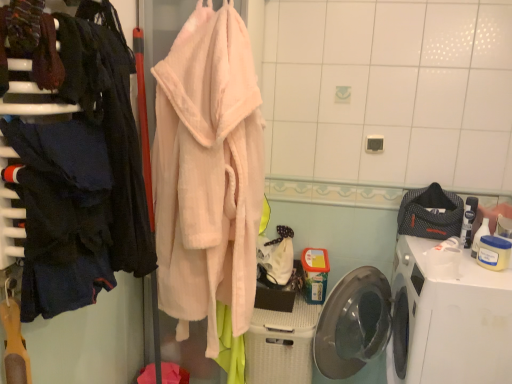
Question: Are white plastic washing machine at lower right and dark blue fabric at left, which is the first closet from front to back, far apart?

Choices:
 (A) yes
 (B) no

Answer: (A)

Question: From the image's perspective, is white plastic washing machine at lower right beneath dark blue fabric at left, the second closet when ordered from back to front?

Choices:
 (A) yes
 (B) no

Answer: (A)

Question: Is white plastic washing machine at lower right oriented away from dark blue fabric at left, which is the first closet from front to back?

Choices:
 (A) no
 (B) yes

Answer: (A)

Question: Considering the relative sizes of white plastic washing machine at lower right and dark blue fabric at left, the second closet when ordered from back to front, in the image provided, is white plastic washing machine at lower right bigger than dark blue fabric at left, the second closet when ordered from back to front,?

Choices:
 (A) no
 (B) yes

Answer: (B)

Question: Is white plastic washing machine at lower right placed right next to dark blue fabric at left, which is the first closet from front to back?

Choices:
 (A) no
 (B) yes

Answer: (A)

Question: Does point (103, 228) appear closer or farther from the camera than point (253, 377)?

Choices:
 (A) closer
 (B) farther

Answer: (A)

Question: Is dark blue fabric at left, marked as the first clothing in a left-to-right arrangement, inside the boundaries of white plastic basket at lower center, or outside?

Choices:
 (A) outside
 (B) inside

Answer: (A)

Question: In terms of width, does dark blue fabric at left, marked as the first clothing in a left-to-right arrangement, look wider or thinner when compared to white plastic basket at lower center?

Choices:
 (A) thin
 (B) wide

Answer: (A)

Question: In terms of size, does dark blue fabric at left, which ranks as the first clothing in front-to-back order, appear bigger or smaller than white plastic basket at lower center?

Choices:
 (A) small
 (B) big

Answer: (A)

Question: From a real-world perspective, is soft pink plush robe at center, which is counted as the 1th closet, starting from the back, positioned above or below peach fluffy bathrobe at center?

Choices:
 (A) below
 (B) above

Answer: (A)

Question: From the image's perspective, is soft pink plush robe at center, which is counted as the 1th closet, starting from the back, above or below peach fluffy bathrobe at center?

Choices:
 (A) below
 (B) above

Answer: (A)

Question: Considering the positions of soft pink plush robe at center, which is counted as the 1th closet, starting from the back, and peach fluffy bathrobe at center in the image, is soft pink plush robe at center, which is counted as the 1th closet, starting from the back, wider or thinner than peach fluffy bathrobe at center?

Choices:
 (A) thin
 (B) wide

Answer: (B)

Question: Would you say soft pink plush robe at center, which is counted as the 1th closet, starting from the back, is to the left or to the right of peach fluffy bathrobe at center in the picture?

Choices:
 (A) right
 (B) left

Answer: (B)

Question: From the image's perspective, relative to soft pink plush robe at center, which is counted as the 1th closet, starting from the back, is dark blue fabric at left, marked as the first clothing in a left-to-right arrangement, above or below?

Choices:
 (A) below
 (B) above

Answer: (B)

Question: From a real-world perspective, relative to soft pink plush robe at center, which is counted as the 1th closet, starting from the back, is dark blue fabric at left, marked as the first clothing in a left-to-right arrangement, vertically above or below?

Choices:
 (A) above
 (B) below

Answer: (A)